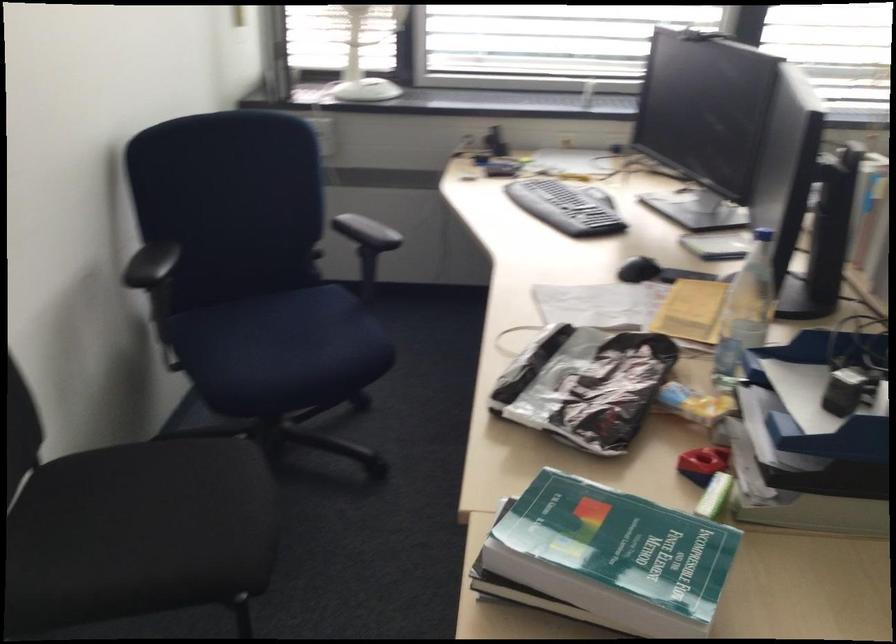
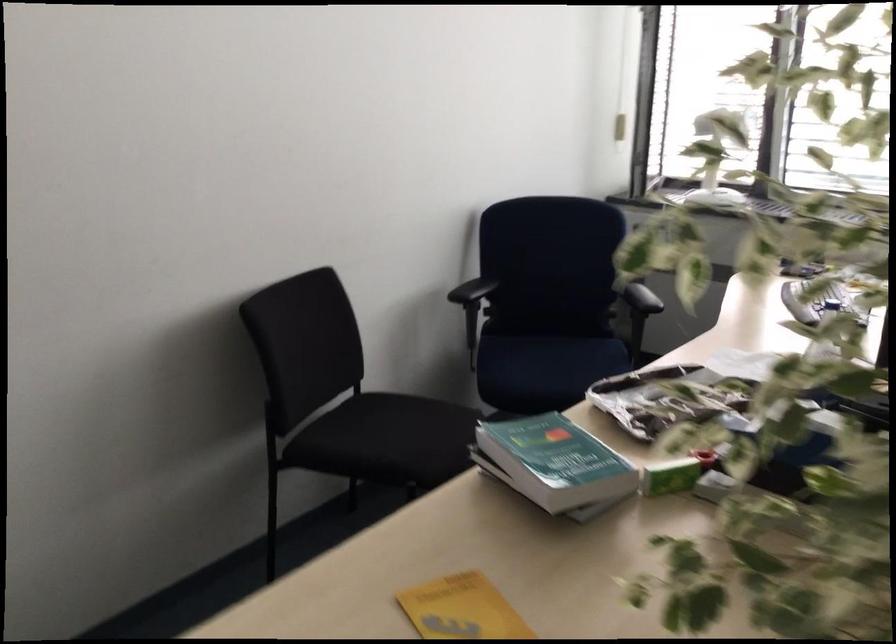
Question: I am providing you with two images of the same scene from different viewpoints. Which of the following objects are not visible in image2?

Choices:
 (A) black chair sitting surface
 (B) blue paper tray
 (C) black pencil
 (D) green cover book

Answer: (B)